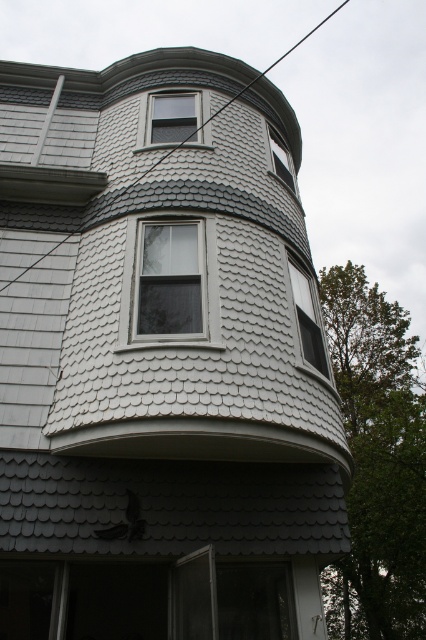
Question: Which point appears closest to the camera in this image?

Choices:
 (A) (299, 316)
 (B) (190, 113)
 (C) (201, 240)

Answer: (C)

Question: Which of the following is the farthest from the observer?

Choices:
 (A) clear glass window at upper center
 (B) white wood window at center
 (C) matte black window at upper center

Answer: (C)

Question: Is clear glass window at center to the right of matte black window at upper center from the viewer's perspective?

Choices:
 (A) no
 (B) yes

Answer: (B)

Question: Based on their relative distances, which object is nearer to the clear glass window at upper center?

Choices:
 (A) clear glass window at center
 (B) white wood window at center
 (C) matte black window at upper center

Answer: (C)

Question: Observing the image, what is the correct spatial positioning of black wire at upper center in reference to matte black window at upper center?

Choices:
 (A) below
 (B) above

Answer: (B)

Question: Is clear glass window at center bigger than black wire at upper center?

Choices:
 (A) no
 (B) yes

Answer: (A)